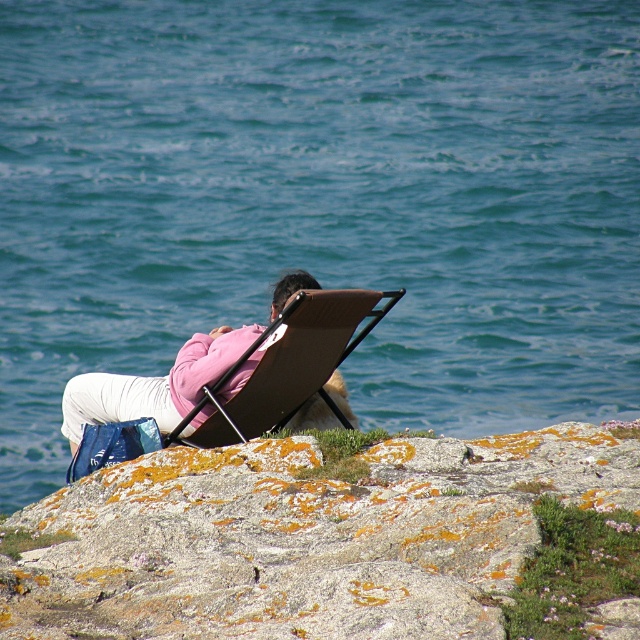
You are standing at the point marked by the coordinates point (304, 538) in the image. Looking around, you see the rocky cliff at lower right. Which direction should you walk to reach the person relaxing on the reclining chair by the sea?

Since the point (304, 538) marks the rocky cliff at lower right, you should walk towards the upper left direction to reach the person relaxing on the reclining chair by the sea.

You are planning to set up a photography studio in this coastal area. You have two chairs available, the pink fabric chair at center and the brown leather chair at center. The client wants to know which chair is better for a closeup shot focusing on the texture of the fabric. Which chair would you recommend?

The pink fabric chair at center has a smaller size compared to the brown leather chair at center, so it would be easier to focus on the texture of the fabric in a closeup shot.

You are a photographer positioned behind the pink fabric chair at center and the brown leather chair at center. Which chair is closer to your camera lens?

The pink fabric chair at center is closer to the camera lens because it is positioned further to the viewer than the brown leather chair at center.